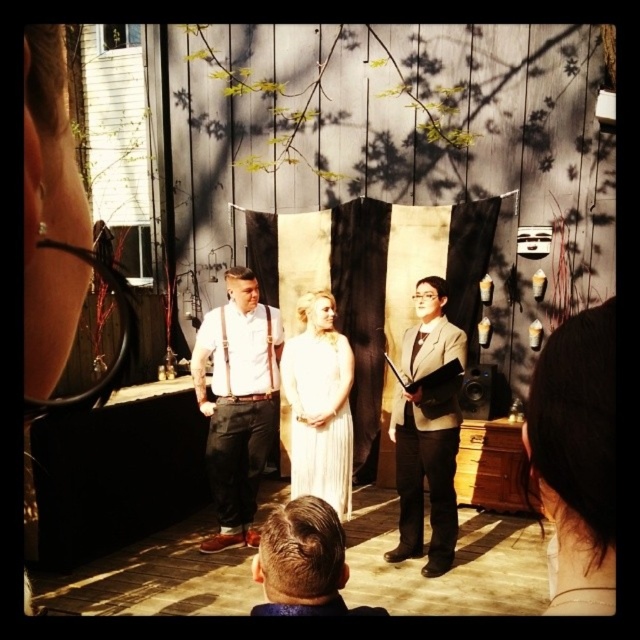
You are a photographer at the wedding ceremony. You need to adjust your camera focus to capture both the brown hair at center and the black satin tie at center. Which one should you focus on first if you want to ensure the larger object is in sharp focus?

The brown hair at center is larger in size than the black satin tie at center, so you should focus on the brown hair at center first to ensure it is in sharp focus.

You are a photographer at a wedding ceremony. You need to take a photo of the matte white shirt at center and the satin beige blazer at center. According to the scene description, which one is positioned to the left?

The matte white shirt at center is positioned to the left of the satin beige blazer at center.

You are a photographer at this event and want to focus your camera on the brown hair at center and the black satin tie at center. Which object should you adjust your focus to first to ensure both are in clear view?

The brown hair at center is closer to the viewer than the black satin tie at center, so you should focus on the brown hair at center first to ensure both are in clear view.